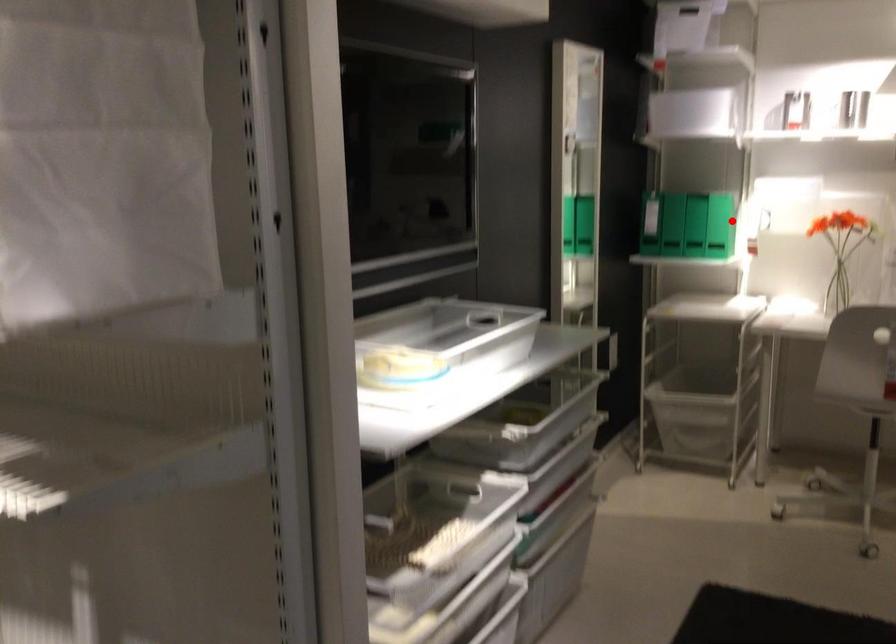
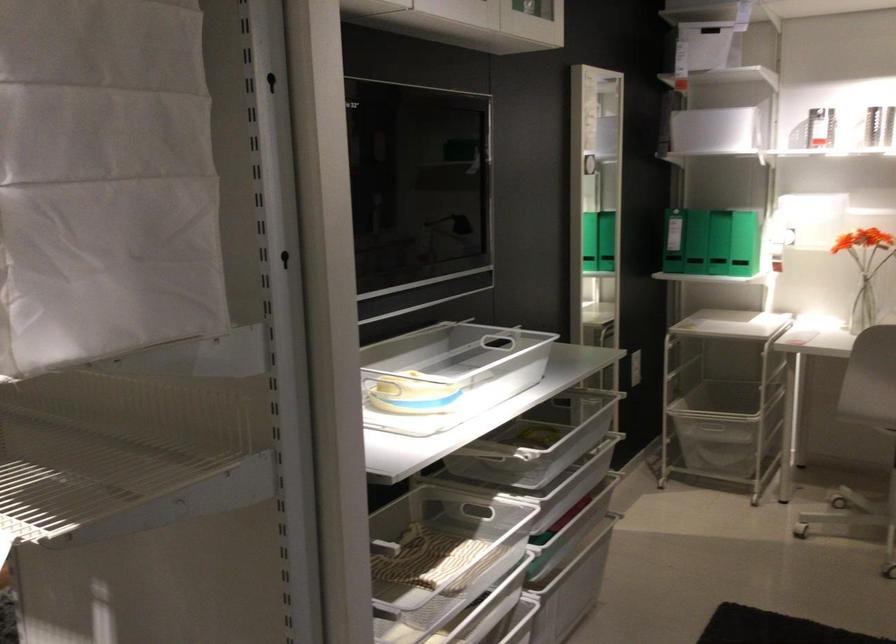
In the second image, find the point that corresponds to the highlighted location in the first image.

(745, 243)